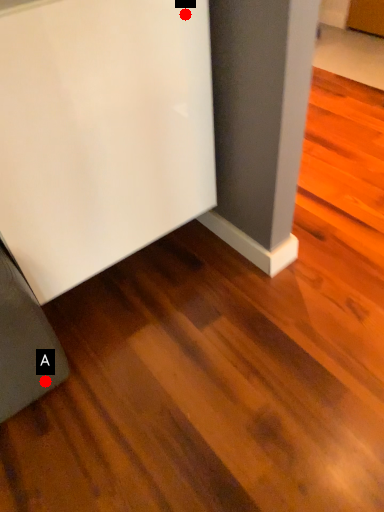
Question: Two points are circled on the image, labeled by A and B beside each circle. Which point is closer to the camera taking this photo?

Choices:
 (A) A is closer
 (B) B is closer

Answer: (B)